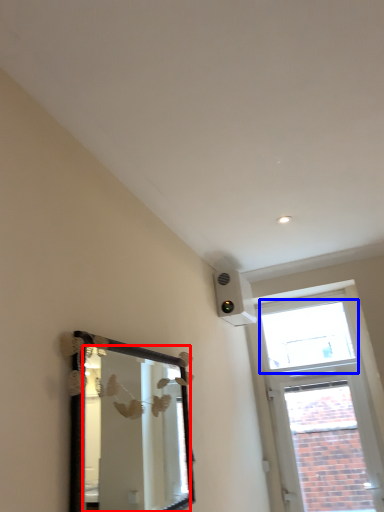
Question: Which object is closer to the camera taking this photo, mirror (highlighted by a red box) or window (highlighted by a blue box)?

Choices:
 (A) mirror
 (B) window

Answer: (A)